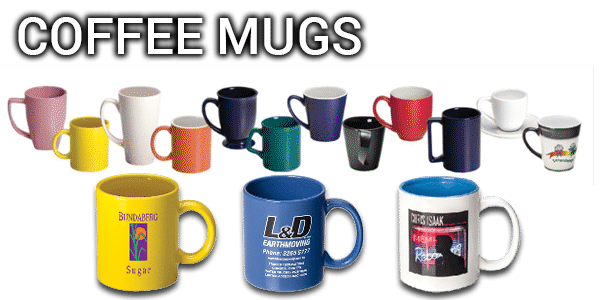
The height and width of the screenshot is (300, 600). What are the coordinates of `pure white mugs` in the screenshot? It's located at (140, 117), (507, 113).